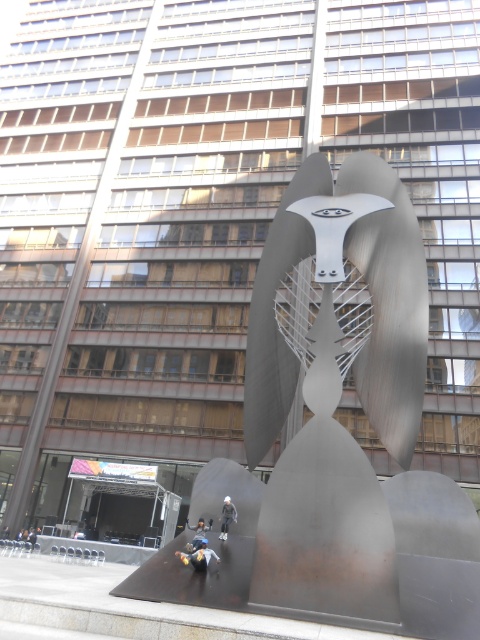
Can you confirm if polished metal sculpture at center is shorter than blue fabric at center?

Indeed, polished metal sculpture at center has a lesser height compared to blue fabric at center.

Does point (319, 588) come behind point (189, 529)?

No, it is in front of (189, 529).

This screenshot has height=640, width=480. I want to click on polished metal sculpture at center, so click(336, 428).

Where is `blue denim jeans at lower center`? Image resolution: width=480 pixels, height=640 pixels. blue denim jeans at lower center is located at coordinates (199, 556).

Describe the element at coordinates (199, 556) in the screenshot. I see `blue denim jeans at lower center` at that location.

What do you see at coordinates (199, 556) in the screenshot? The image size is (480, 640). I see `blue denim jeans at lower center` at bounding box center [199, 556].

This screenshot has width=480, height=640. Find the location of `blue denim jeans at lower center`. blue denim jeans at lower center is located at coordinates (199, 556).

Who is higher up, white matte figure at center or blue fabric at center?

Positioned higher is white matte figure at center.

Is point (226, 499) more distant than point (195, 540)?

Yes.

Where is `white matte figure at center`? The image size is (480, 640). white matte figure at center is located at coordinates 227,516.